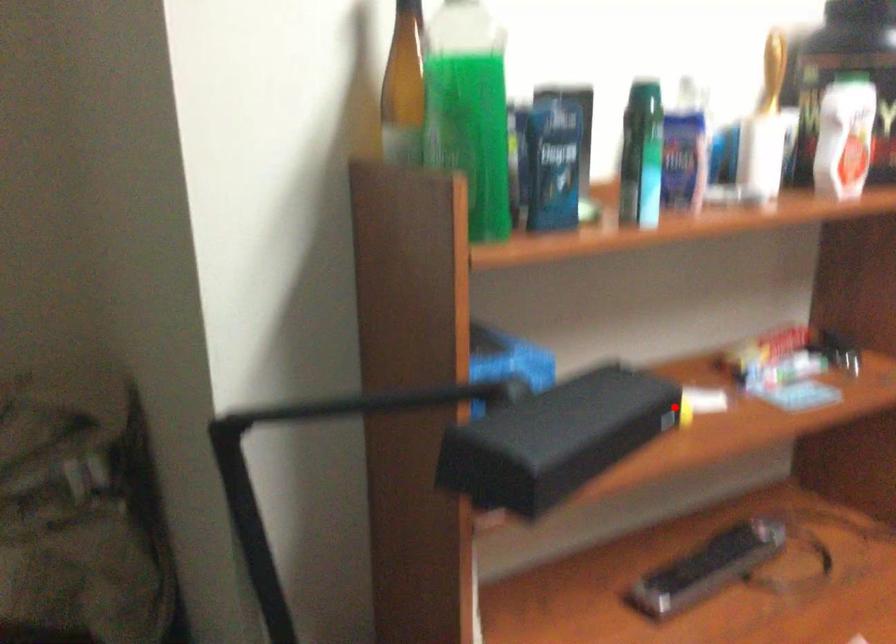
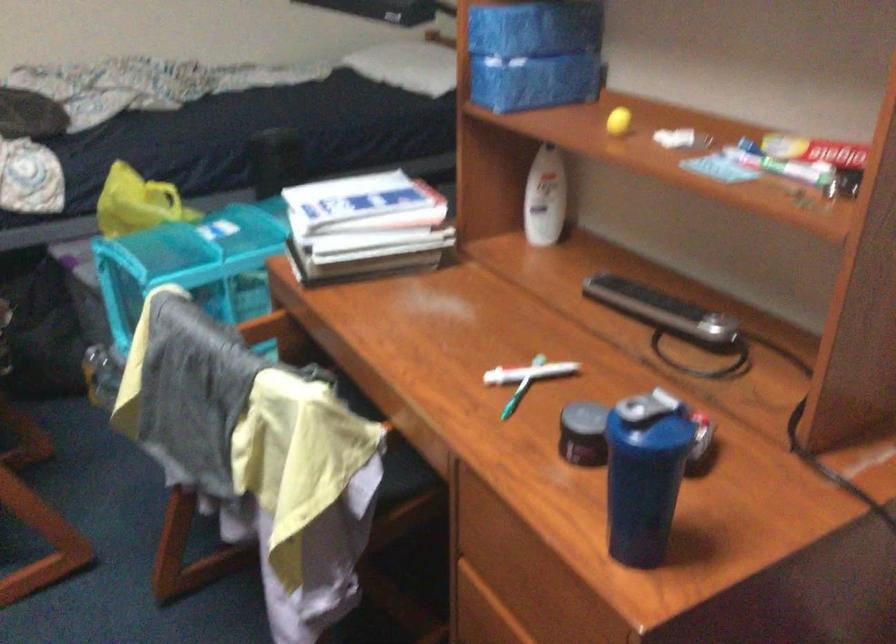
The point at the highlighted location is marked in the first image. Where is the corresponding point in the second image?

(617, 120)